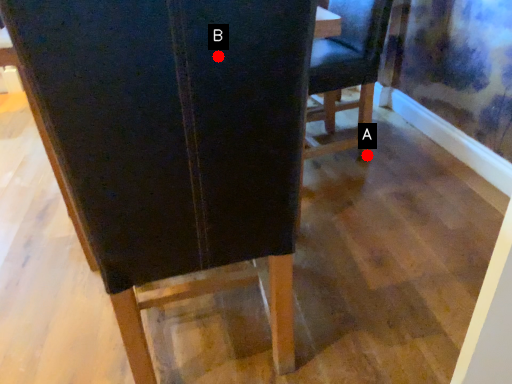
Question: Two points are circled on the image, labeled by A and B beside each circle. Which point is farther from the camera taking this photo?

Choices:
 (A) A is further
 (B) B is further

Answer: (A)